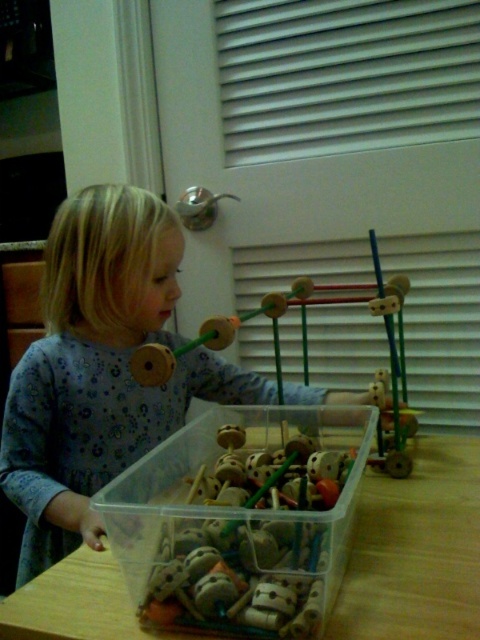
Question: Which point is closer to the camera?

Choices:
 (A) (443, 598)
 (B) (217, 548)
 (C) (70, 308)
 (D) (276, 381)

Answer: (B)

Question: Which object appears farthest from the camera in this image?

Choices:
 (A) blue fabric dress at center
 (B) wooden toy at center
 (C) wooden beads at center
 (D) wooden table at lower center

Answer: (A)

Question: Can you confirm if wooden table at lower center is positioned to the left of wooden toy at center?

Choices:
 (A) yes
 (B) no

Answer: (B)

Question: Does blue fabric dress at center lie behind wooden toy at center?

Choices:
 (A) no
 (B) yes

Answer: (B)

Question: Among these objects, which one is nearest to the camera?

Choices:
 (A) wooden beads at center
 (B) wooden table at lower center
 (C) blue fabric dress at center

Answer: (B)

Question: Is blue fabric dress at center smaller than wooden toy at center?

Choices:
 (A) yes
 (B) no

Answer: (B)